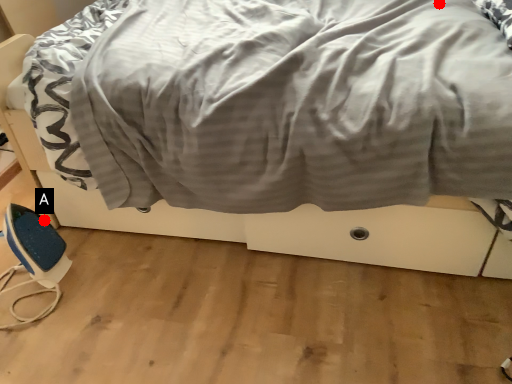
Question: Two points are circled on the image, labeled by A and B beside each circle. Which point appears farthest from the camera in this image?

Choices:
 (A) A is further
 (B) B is further

Answer: (A)